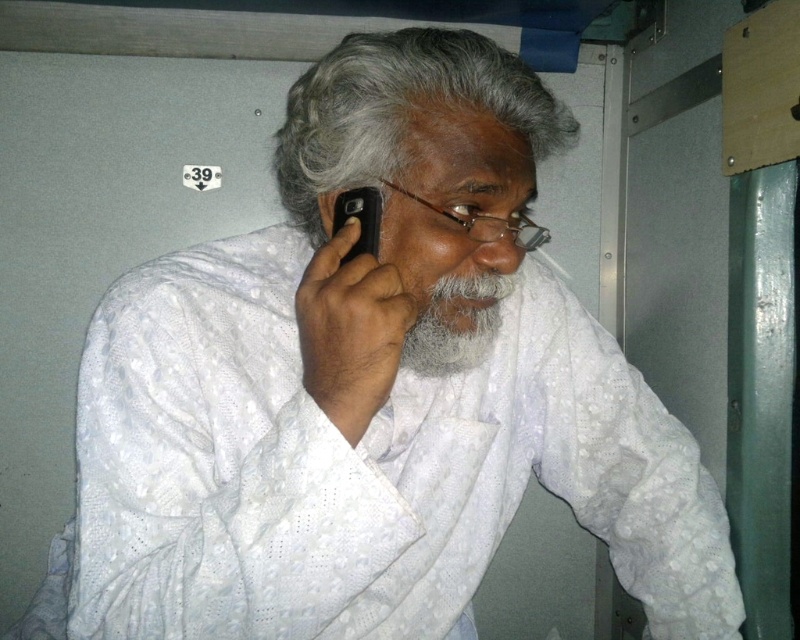
Question: Estimate the real-world distances between objects in this image. Which object is closer to the matte black ear at upper right?

Choices:
 (A) gray matte hair at upper center
 (B) black matte smartphone at upper center
 (C) graywoollybeard at center

Answer: (B)

Question: Which point appears farthest from the camera in this image?

Choices:
 (A) (429, 368)
 (B) (376, 232)

Answer: (A)

Question: Is black matte smartphone at upper center thinner than matte black ear at upper right?

Choices:
 (A) yes
 (B) no

Answer: (B)

Question: Does graywoollybeard at center appear on the left side of matte black ear at upper right?

Choices:
 (A) yes
 (B) no

Answer: (B)

Question: Estimate the real-world distances between objects in this image. Which object is farther from the black matte smartphone at upper center?

Choices:
 (A) gray matte hair at upper center
 (B) graywoollybeard at center

Answer: (B)

Question: Does graywoollybeard at center appear on the left side of matte black ear at upper right?

Choices:
 (A) no
 (B) yes

Answer: (A)